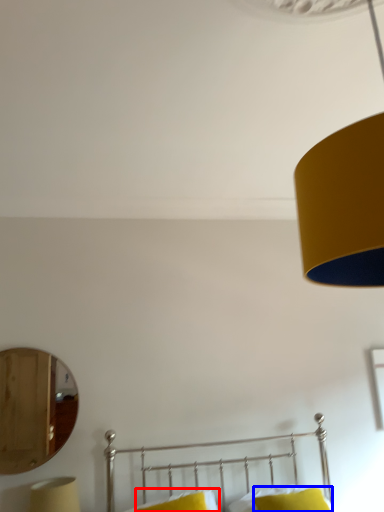
Question: Which object appears closest to the camera in this image, pillow (highlighted by a red box) or pillow (highlighted by a blue box)?

Choices:
 (A) pillow
 (B) pillow

Answer: (B)